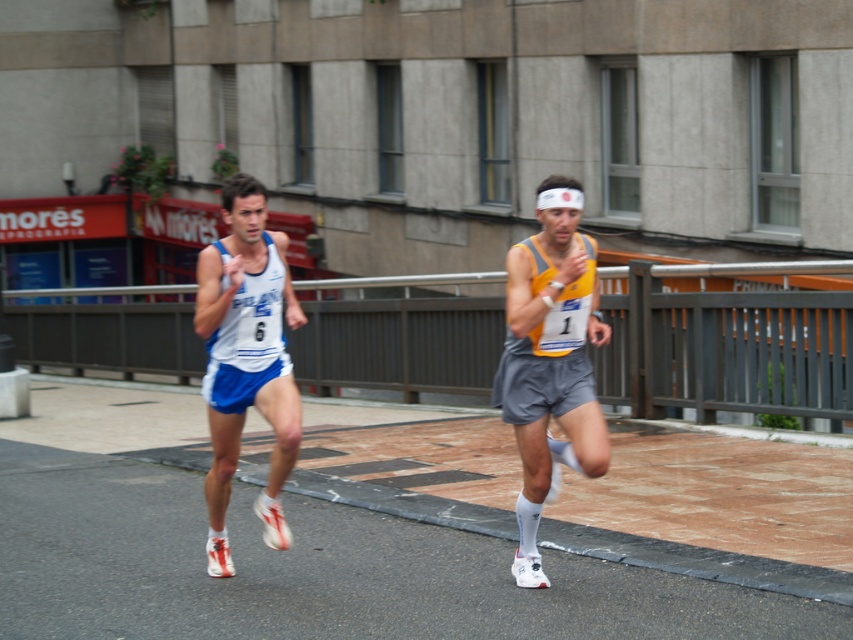
Is yellow fabric tank top at center to the left of white fabric tank top at left from the viewer's perspective?

No, yellow fabric tank top at center is not to the left of white fabric tank top at left.

Which is in front, point (523, 460) or point (227, 426)?

Point (523, 460)

Is point (553, 259) behind point (294, 436)?

No, (553, 259) is closer to viewer.

This screenshot has width=853, height=640. Find the location of `yellow fabric tank top at center`. yellow fabric tank top at center is located at coordinates (550, 358).